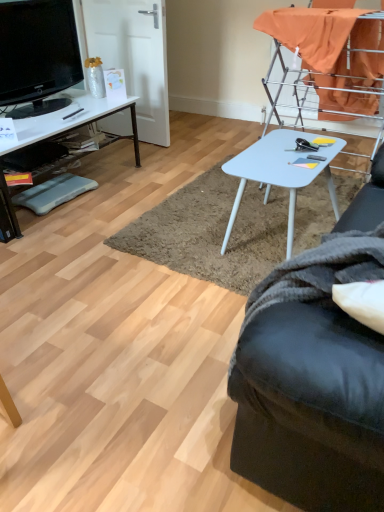
You are a GUI agent. You are given a task and a screenshot of the screen. Output one action in this format:
    pyautogui.click(x=<x>, y=<y>)
    Task: Click on the free space in front of black plastic pen at left
    The image size is (384, 512).
    Given the screenshot: What is the action you would take?
    pyautogui.click(x=49, y=125)